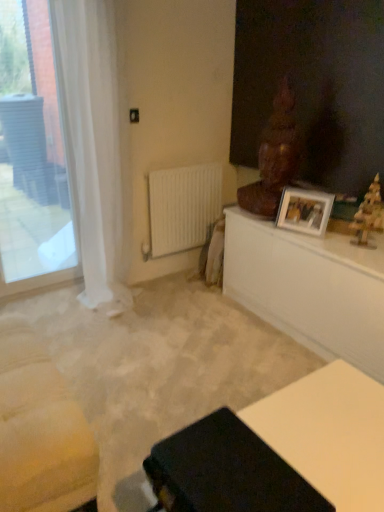
Question: From a real-world perspective, is wooden statue at upper right, the 1th sculpture positioned from the left, below white glossy table at upper right, the second table from the front?

Choices:
 (A) yes
 (B) no

Answer: (B)

Question: Does wooden statue at upper right, which is the first sculpture from back to front, have a lesser width compared to white glossy table at upper right, the second table in the bottom-to-top sequence?

Choices:
 (A) yes
 (B) no

Answer: (A)

Question: Does wooden statue at upper right, which is the first sculpture from back to front, have a greater height compared to white glossy table at upper right, the 1th table when ordered from back to front?

Choices:
 (A) no
 (B) yes

Answer: (B)

Question: Are wooden statue at upper right, which ranks as the second sculpture in front-to-back order, and white glossy table at upper right, the 1th table when ordered from back to front, making contact?

Choices:
 (A) no
 (B) yes

Answer: (A)

Question: Considering the relative positions of wooden statue at upper right, the second sculpture in the right-to-left sequence, and white glossy table at upper right, the second table in the bottom-to-top sequence, in the image provided, is wooden statue at upper right, the second sculpture in the right-to-left sequence, behind white glossy table at upper right, the second table in the bottom-to-top sequence,?

Choices:
 (A) no
 (B) yes

Answer: (B)

Question: From the image's perspective, would you say wooden statue at upper right, the second sculpture in the right-to-left sequence, is positioned over white glossy table at upper right, which is counted as the 1th table, starting from the top?

Choices:
 (A) no
 (B) yes

Answer: (B)

Question: Is white glossy table at upper right, the second table in the bottom-to-top sequence, beside transparent glass window at left?

Choices:
 (A) yes
 (B) no

Answer: (B)

Question: Is transparent glass window at left located within white glossy table at upper right, the second table from the front?

Choices:
 (A) yes
 (B) no

Answer: (B)

Question: Is white glossy table at upper right, which is counted as the 1th table, starting from the top, oriented away from transparent glass window at left?

Choices:
 (A) yes
 (B) no

Answer: (B)

Question: From a real-world perspective, is white glossy table at upper right, the second table from the front, positioned over transparent glass window at left based on gravity?

Choices:
 (A) no
 (B) yes

Answer: (A)

Question: Is white glossy table at upper right, which is counted as the 1th table, starting from the top, outside of transparent glass window at left?

Choices:
 (A) no
 (B) yes

Answer: (B)

Question: From a real-world perspective, is white glossy table at upper right, which is counted as the 1th table, starting from the top, physically below transparent glass window at left?

Choices:
 (A) yes
 (B) no

Answer: (A)

Question: Considering the relative sizes of wooden christmas tree at right, which is the second sculpture in left-to-right order, and white glossy table at upper right, the 1th table when ordered from back to front, in the image provided, is wooden christmas tree at right, which is the second sculpture in left-to-right order, smaller than white glossy table at upper right, the 1th table when ordered from back to front,?

Choices:
 (A) yes
 (B) no

Answer: (A)